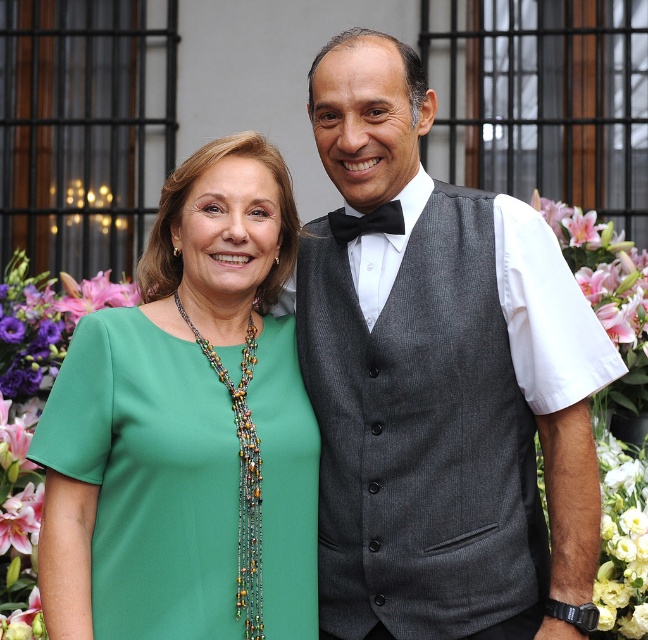
Question: Which point is closer to the camera?

Choices:
 (A) (640, 307)
 (B) (218, 413)

Answer: (B)

Question: Does green fabric dress at left have a lesser width compared to pink silk flower at right?

Choices:
 (A) yes
 (B) no

Answer: (B)

Question: Among these points, which one is nearest to the camera?

Choices:
 (A) (373, 332)
 (B) (572, 244)

Answer: (A)

Question: Can you confirm if matte gray vest at center is positioned above black satin bow tie at center?

Choices:
 (A) no
 (B) yes

Answer: (A)

Question: Does green satin blouse at center have a smaller size compared to pink lily at upper right?

Choices:
 (A) no
 (B) yes

Answer: (A)

Question: Estimate the real-world distances between objects in this image. Which object is closer to the pink lily at upper right?

Choices:
 (A) green fabric dress at left
 (B) matte gray vest at center
 (C) pink lilies at right
 (D) black satin bow tie at center

Answer: (C)